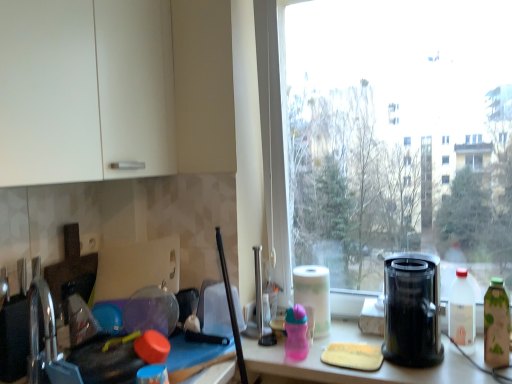
Question: In terms of height, does green matte bottle at right, which is the 3th bottle in left-to-right order, look taller or shorter compared to black plastic juicer at right?

Choices:
 (A) short
 (B) tall

Answer: (A)

Question: In the image, is green matte bottle at right, which is the 3th bottle in left-to-right order, positioned in front of or behind black plastic juicer at right?

Choices:
 (A) front
 (B) behind

Answer: (B)

Question: Estimate the real-world distances between objects in this image. Which object is closer to the white plastic bottle at right, arranged as the second bottle when viewed from the left?

Choices:
 (A) pink plastic sippy cup at center, which appears as the third bottle when viewed from the right
 (B) black plastic juicer at right
 (C) transparent glass window at center
 (D) white paper at window
 (E) green matte bottle at right, which is the 3th bottle in left-to-right order

Answer: (E)

Question: Which object is the farthest from the black plastic juicer at right?

Choices:
 (A) transparent glass window at center
 (B) green matte bottle at right, which is the 3th bottle in left-to-right order
 (C) white paper at window
 (D) white plastic bottle at right, which is counted as the 2th bottle, starting from the right
 (E) pink plastic sippy cup at center, the first bottle when ordered from left to right

Answer: (A)